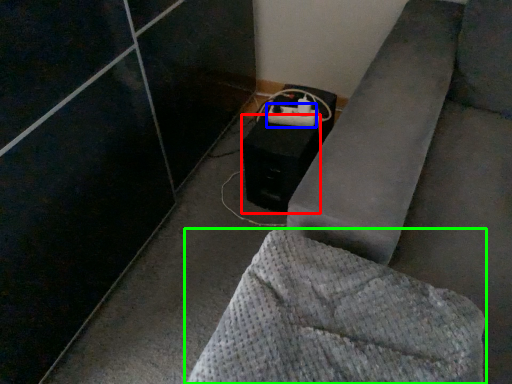
Question: Which is nearer to the speaker (highlighted by a red box)? extension cord (highlighted by a blue box) or furniture (highlighted by a green box).

Choices:
 (A) extension cord
 (B) furniture

Answer: (A)